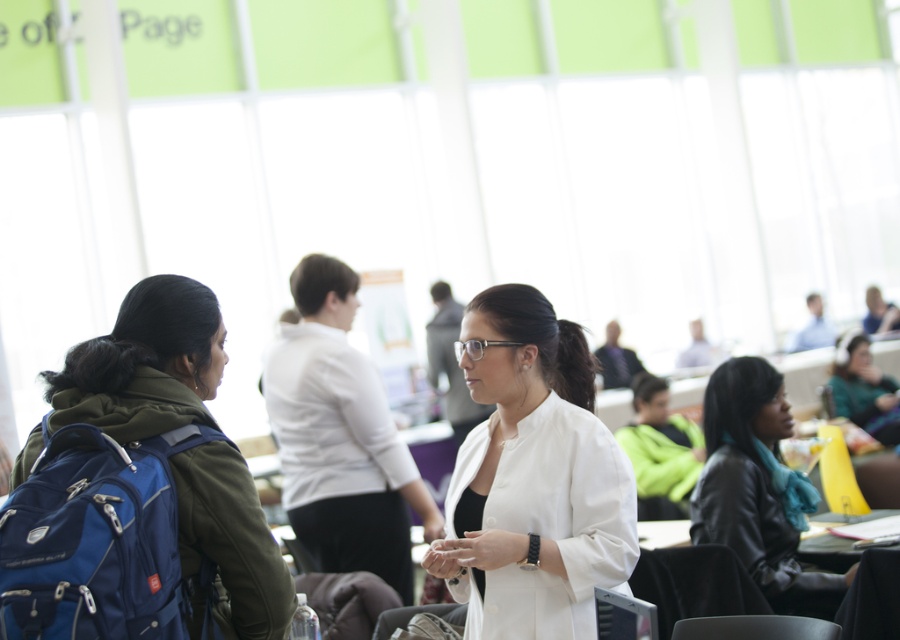
You are standing in the conference room and want to hand a document to the person wearing the white matte blazer at center and the person wearing the matte green sweater at right. Which person should you approach first if you want to reach the closest one first?

You should approach the white matte blazer at center first because it is closer to the viewer than the matte green sweater at right.

You are a person standing at the viewer position in the image. You want to hand a document to the person wearing the white matte blazer at center. How many steps do you need to take to reach them?

The white matte blazer at center and viewer are 8.82 feet apart from each other. Assuming an average step length of about 2.5 feet, you would need approximately 4 steps to cover the distance.

Consider the image. You are organizing a photo shoot and need to position a light source to highlight both the white matte blazer at center and the black leather jacket at lower right. Based on their positions, where should you place the light source relative to these two objects to ensure both are well lit?

The white matte blazer at center is located above the black leather jacket at lower right. To ensure both are well lit, position the light source above the white matte blazer at center so that it illuminates both the blazer and the jacket below it.